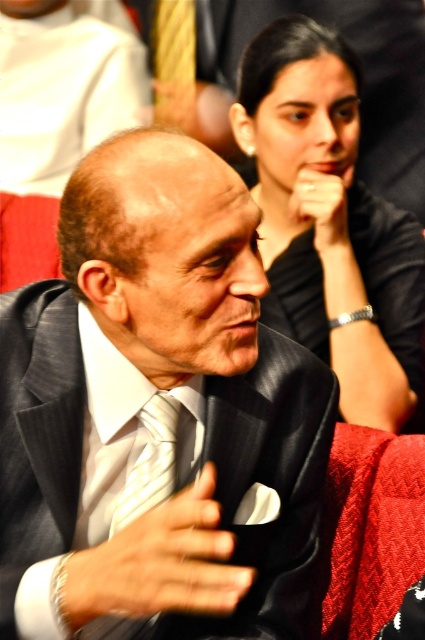
Is black silk dress at upper right smaller than white striped tie at center?

No, black silk dress at upper right is not smaller than white striped tie at center.

Between black silk dress at upper right and white striped tie at center, which one is positioned higher?

Positioned higher is black silk dress at upper right.

The width and height of the screenshot is (425, 640). Find the location of `black silk dress at upper right`. black silk dress at upper right is located at coordinates (329, 221).

Can you confirm if shiny black suit at center is positioned to the right of white striped tie at center?

Indeed, shiny black suit at center is positioned on the right side of white striped tie at center.

Is shiny black suit at center bigger than white striped tie at center?

Yes, shiny black suit at center is bigger than white striped tie at center.

Does point (71, 419) lie in front of point (125, 524)?

That is True.

Locate an element on the screen. shiny black suit at center is located at coordinates (156, 417).

Can you confirm if shiny black suit at center is bigger than black silk dress at upper right?

Correct, shiny black suit at center is larger in size than black silk dress at upper right.

Can you confirm if shiny black suit at center is positioned below black silk dress at upper right?

Indeed, shiny black suit at center is positioned under black silk dress at upper right.

This screenshot has height=640, width=425. Find the location of `shiny black suit at center`. shiny black suit at center is located at coordinates (156, 417).